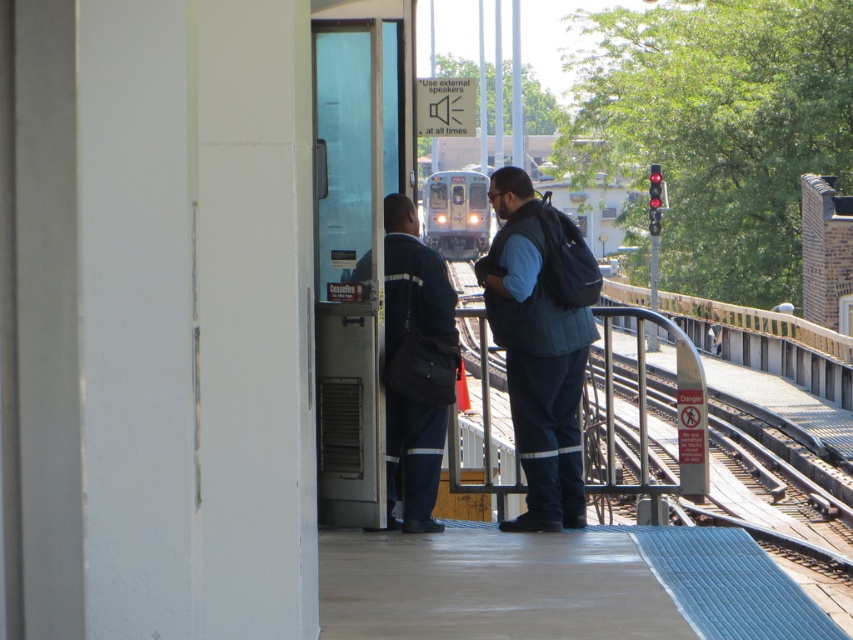
Question: Does metal train track at center appear on the right side of dark blue quilted vest at center?

Choices:
 (A) no
 (B) yes

Answer: (B)

Question: Considering the real-world distances, which object is farthest from the dark blue uniform at center?

Choices:
 (A) dark blue quilted vest at center
 (B) metal train track at center

Answer: (B)

Question: Among these objects, which one is nearest to the camera?

Choices:
 (A) dark blue uniform at center
 (B) silver metallic train at center
 (C) dark blue quilted vest at center
 (D) metal train track at center

Answer: (C)

Question: Is dark blue quilted vest at center bigger than silver metallic train at center?

Choices:
 (A) no
 (B) yes

Answer: (B)

Question: Which point is farther from the camera taking this photo?

Choices:
 (A) click(479, 230)
 (B) click(807, 529)

Answer: (A)

Question: Can you confirm if dark blue quilted vest at center is thinner than silver metallic train at center?

Choices:
 (A) yes
 (B) no

Answer: (B)